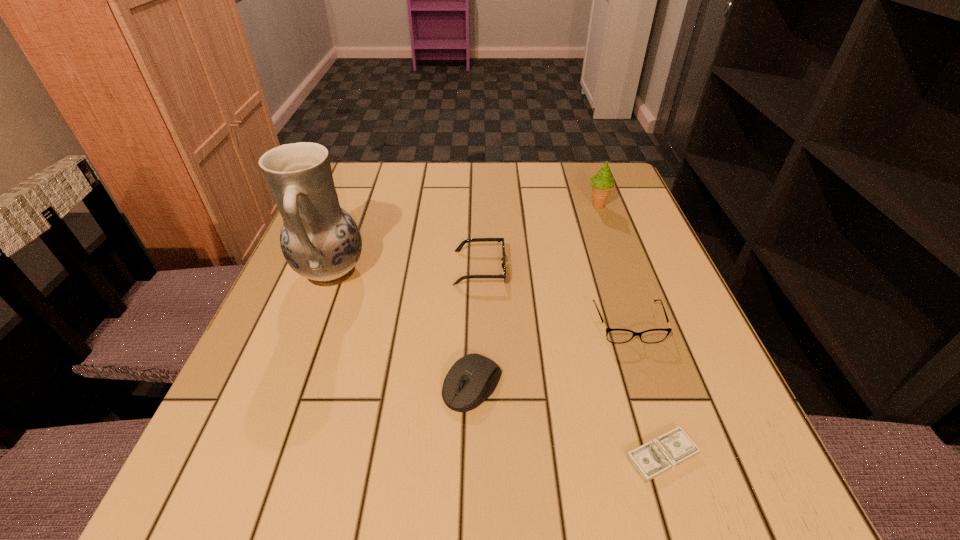
Identify the location of the tallest object. [x=320, y=241].

Image resolution: width=960 pixels, height=540 pixels. I want to click on the leftmost object, so click(x=320, y=241).

The height and width of the screenshot is (540, 960). Identify the location of the fifth shortest object. (602, 183).

Where is `icecream`? The image size is (960, 540). icecream is located at coordinates (602, 183).

At what (x,y) coordinates should I click in order to perform the action: click on sunglasses. Please return your answer as a coordinate pair (x, y). Image resolution: width=960 pixels, height=540 pixels. Looking at the image, I should click on (458, 249).

Locate an element on the screen. Image resolution: width=960 pixels, height=540 pixels. spectacles is located at coordinates (617, 336).

The height and width of the screenshot is (540, 960). I want to click on computer equipment, so click(x=473, y=378).

Find the location of a particular element. money is located at coordinates (652, 459).

Locate an element on the screen. the nearest object is located at coordinates (652, 459).

Where is `free space located 0.240m on the front of the pottery`? The width and height of the screenshot is (960, 540). free space located 0.240m on the front of the pottery is located at coordinates (273, 423).